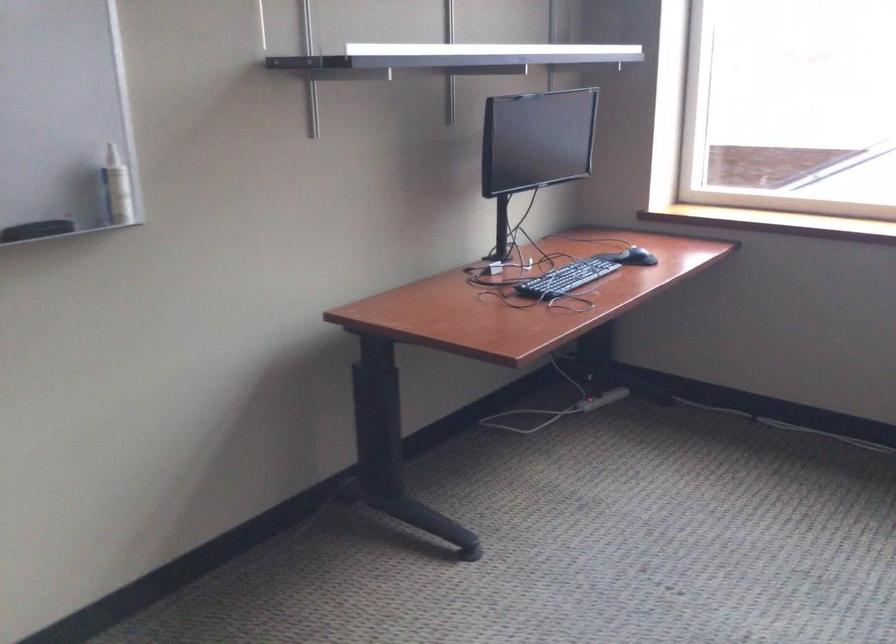
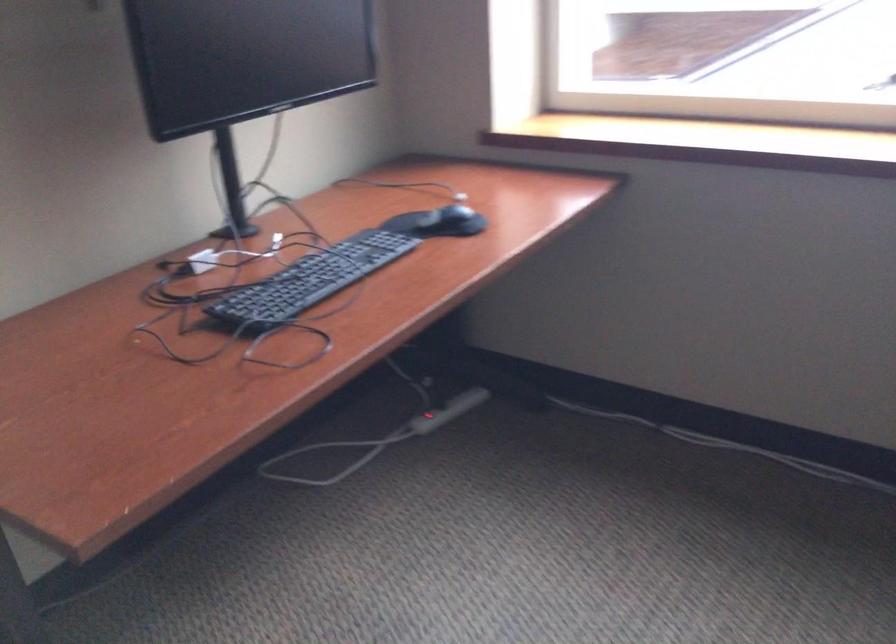
Question: I am providing you with two images of the same scene from different viewpoints. After the viewpoint changes to image2, which objects are now occluded?

Choices:
 (A) black computer mouse
 (B) power strip switch
 (C) white power adapter
 (D) none of these

Answer: (D)